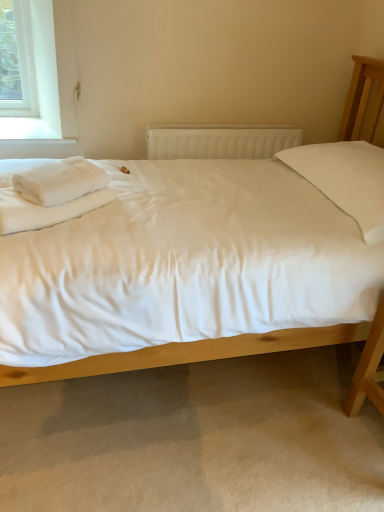
Question: Is white cotton bed at center outside of white fluffy towel at left?

Choices:
 (A) yes
 (B) no

Answer: (A)

Question: Is white cotton bed at center next to white fluffy towel at left?

Choices:
 (A) yes
 (B) no

Answer: (B)

Question: From a real-world perspective, is white cotton bed at center positioned over white fluffy towel at left based on gravity?

Choices:
 (A) yes
 (B) no

Answer: (B)

Question: Can you confirm if white cotton bed at center is shorter than white fluffy towel at left?

Choices:
 (A) no
 (B) yes

Answer: (A)

Question: Does white cotton bed at center appear on the right side of white fluffy towel at left?

Choices:
 (A) no
 (B) yes

Answer: (B)

Question: Is white soft bedsheet at left inside or outside of white cotton bed at center?

Choices:
 (A) outside
 (B) inside

Answer: (B)

Question: Is point (13, 203) positioned closer to the camera than point (188, 355)?

Choices:
 (A) farther
 (B) closer

Answer: (B)

Question: From the image's perspective, relative to white cotton bed at center, is white soft bedsheet at left above or below?

Choices:
 (A) above
 (B) below

Answer: (A)

Question: From a real-world perspective, is white soft bedsheet at left physically located above or below white cotton bed at center?

Choices:
 (A) below
 (B) above

Answer: (B)

Question: Is white fluffy towel at left to the left or to the right of white soft bedsheet at left in the image?

Choices:
 (A) left
 (B) right

Answer: (B)

Question: Is white fluffy towel at left wider or thinner than white soft bedsheet at left?

Choices:
 (A) thin
 (B) wide

Answer: (A)

Question: Considering the positions of white fluffy towel at left and white soft bedsheet at left in the image, is white fluffy towel at left bigger or smaller than white soft bedsheet at left?

Choices:
 (A) big
 (B) small

Answer: (B)

Question: Considering their positions, is white fluffy towel at left located in front of or behind white soft bedsheet at left?

Choices:
 (A) behind
 (B) front

Answer: (A)

Question: From a real-world perspective, is white soft bedsheet at left positioned above or below white plastic radiator at center?

Choices:
 (A) above
 (B) below

Answer: (A)

Question: Is white soft bedsheet at left to the left or to the right of white plastic radiator at center in the image?

Choices:
 (A) right
 (B) left

Answer: (B)